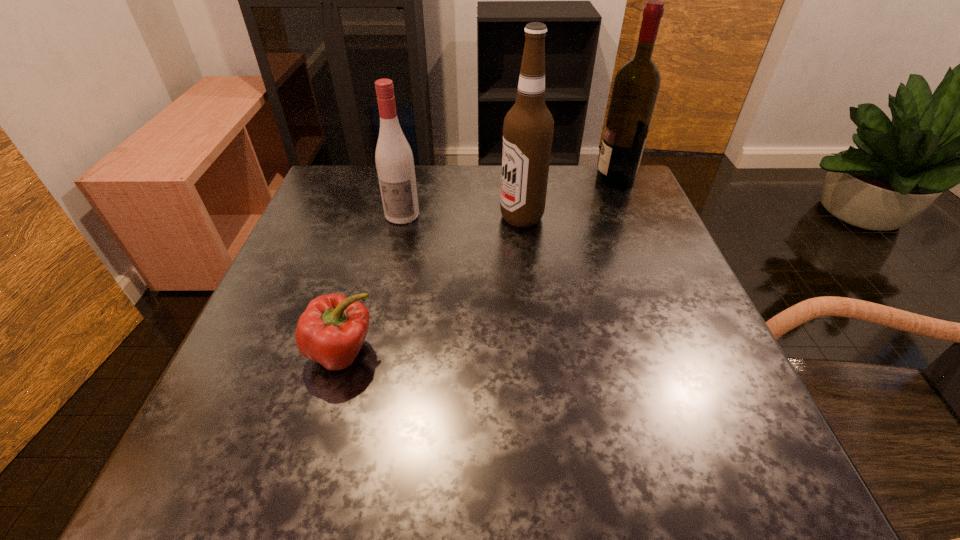
I want to click on free spot at the left edge of the desktop, so click(x=348, y=265).

I want to click on vacant space at the right edge, so click(x=682, y=267).

Locate an element on the screen. vacant space at the far right corner is located at coordinates (585, 208).

You are a GUI agent. You are given a task and a screenshot of the screen. Output one action in this format:
    pyautogui.click(x=<x>, y=<y>)
    Task: Click on the free space between the rightmost alcohol and the second alcohol from left to right
    Image resolution: width=960 pixels, height=540 pixels.
    Given the screenshot: What is the action you would take?
    pyautogui.click(x=568, y=198)

At what (x,y) coordinates should I click in order to perform the action: click on free space between the third object from left to right and the shortest object. Please return your answer as a coordinate pair (x, y). This screenshot has height=540, width=960. Looking at the image, I should click on (432, 284).

The width and height of the screenshot is (960, 540). Identify the location of vacant point located between the nearest object and the second object from right to left. (432, 284).

Where is `unoccupied area between the second alcohol from right to left and the shortest object`? Image resolution: width=960 pixels, height=540 pixels. unoccupied area between the second alcohol from right to left and the shortest object is located at coordinates (432, 284).

This screenshot has height=540, width=960. I want to click on vacant area that lies between the second shortest object and the second alcohol from left to right, so click(x=462, y=216).

Locate an element on the screen. vacant space that is in between the rightmost alcohol and the second alcohol from right to left is located at coordinates (568, 198).

Image resolution: width=960 pixels, height=540 pixels. What are the coordinates of `free space between the rightmost object and the nearest object` in the screenshot? It's located at click(x=478, y=266).